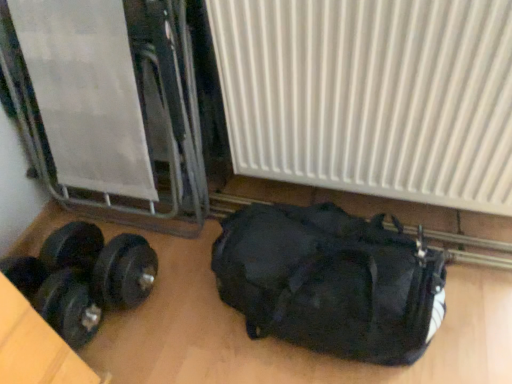
Question: Can you confirm if white ribbed radiator at center is positioned to the right of black rubber dumbbell at lower left?

Choices:
 (A) no
 (B) yes

Answer: (B)

Question: Does white ribbed radiator at center come in front of black rubber dumbbell at lower left?

Choices:
 (A) yes
 (B) no

Answer: (A)

Question: Would you consider white ribbed radiator at center to be distant from black rubber dumbbell at lower left?

Choices:
 (A) no
 (B) yes

Answer: (A)

Question: Can you confirm if white ribbed radiator at center is thinner than black rubber dumbbell at lower left?

Choices:
 (A) yes
 (B) no

Answer: (A)

Question: From the image's perspective, is white ribbed radiator at center located above black rubber dumbbell at lower left?

Choices:
 (A) yes
 (B) no

Answer: (A)

Question: From a real-world perspective, is white ribbed radiator at center physically located above or below black matte duffel bag at lower right?

Choices:
 (A) below
 (B) above

Answer: (B)

Question: Is white ribbed radiator at center situated inside black matte duffel bag at lower right or outside?

Choices:
 (A) inside
 (B) outside

Answer: (B)

Question: Considering the relative positions of white ribbed radiator at center and black matte duffel bag at lower right in the image provided, is white ribbed radiator at center to the left or to the right of black matte duffel bag at lower right?

Choices:
 (A) right
 (B) left

Answer: (A)

Question: Looking at their shapes, would you say white ribbed radiator at center is wider or thinner than black matte duffel bag at lower right?

Choices:
 (A) wide
 (B) thin

Answer: (B)

Question: In terms of size, does white ribbed radiator at center appear bigger or smaller than black rubber dumbbell at lower left?

Choices:
 (A) big
 (B) small

Answer: (A)

Question: Considering the positions of white ribbed radiator at center and black rubber dumbbell at lower left in the image, is white ribbed radiator at center taller or shorter than black rubber dumbbell at lower left?

Choices:
 (A) tall
 (B) short

Answer: (A)

Question: Considering the positions of point coord(382,84) and point coord(25,268), is point coord(382,84) closer or farther from the camera than point coord(25,268)?

Choices:
 (A) closer
 (B) farther

Answer: (A)

Question: Is white ribbed radiator at center to the left or to the right of black rubber dumbbell at lower left in the image?

Choices:
 (A) left
 (B) right

Answer: (B)

Question: From the image's perspective, relative to white ribbed radiator at center, is black rubber dumbbell at lower left above or below?

Choices:
 (A) below
 (B) above

Answer: (A)

Question: Is black rubber dumbbell at lower left taller or shorter than white ribbed radiator at center?

Choices:
 (A) short
 (B) tall

Answer: (A)